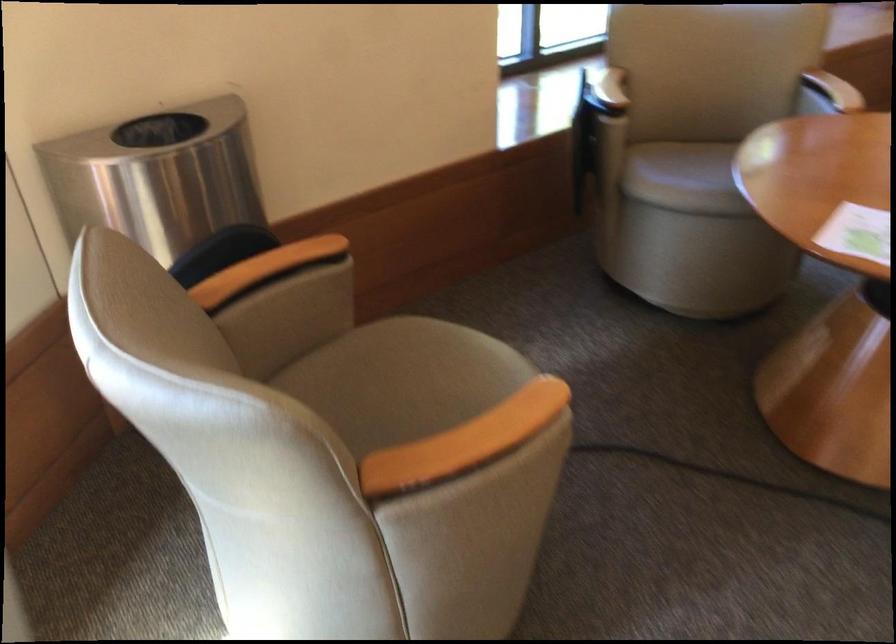
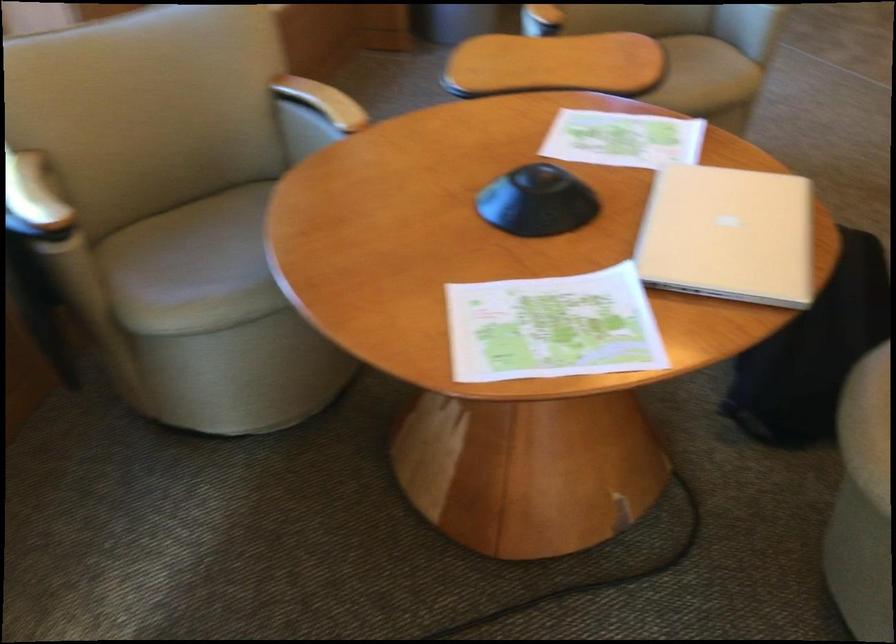
Find the pixel in the second image that matches (691,164) in the first image.

(193, 267)